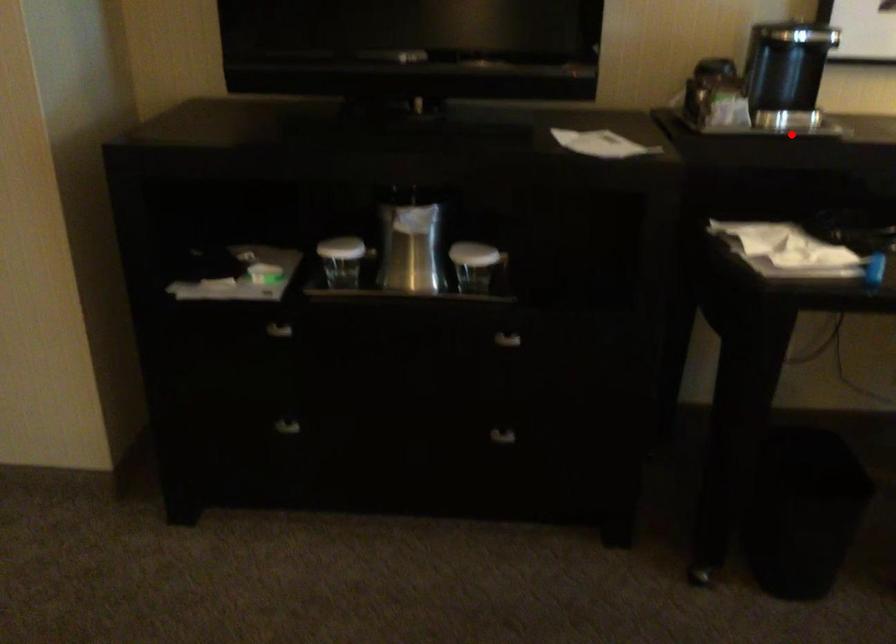
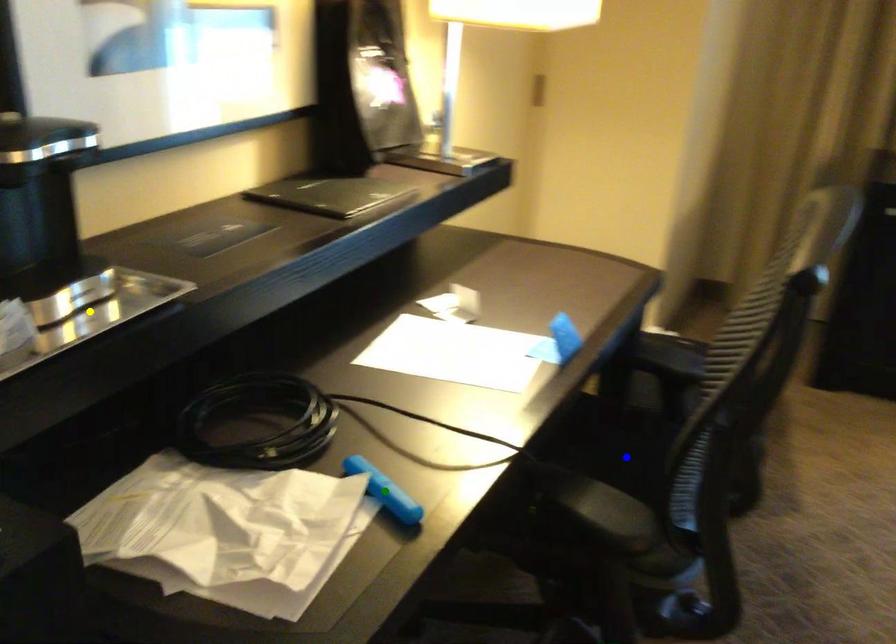
Question: I am providing you with two images of the same scene from different viewpoints. A red point is marked on the first image. You are given multiple points on the second image. Which point in image 2 represents the same 3d spot as the red point in image 1?

Choices:
 (A) green point
 (B) yellow point
 (C) blue point

Answer: (B)